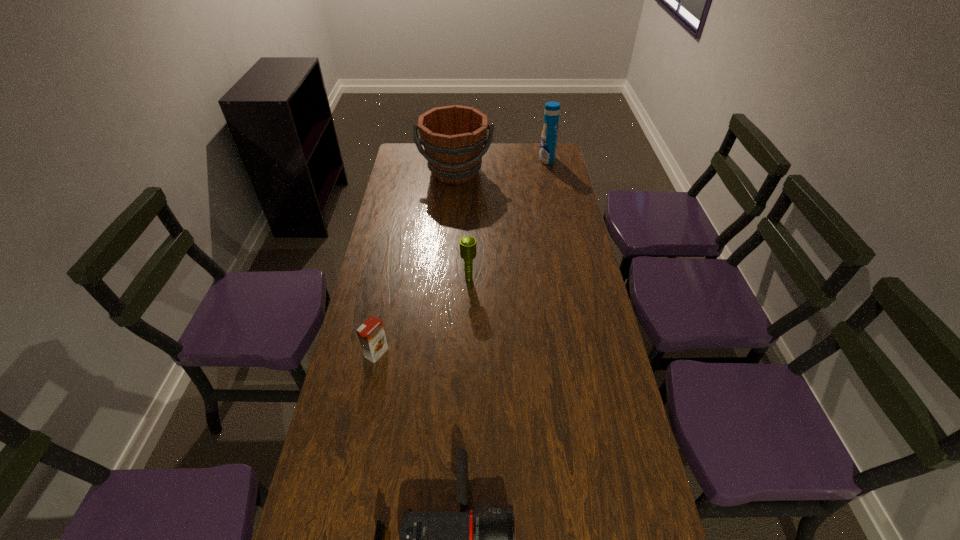
Image resolution: width=960 pixels, height=540 pixels. I want to click on free location located 0.120m on the back of the fourth farthest object, so click(385, 313).

Where is `detergent positioned at the far edge`? The width and height of the screenshot is (960, 540). detergent positioned at the far edge is located at coordinates (548, 143).

This screenshot has height=540, width=960. What are the coordinates of `bucket at the far edge` in the screenshot? It's located at (453, 137).

Locate an element on the screen. This screenshot has height=540, width=960. bucket present at the left edge is located at coordinates (453, 137).

Locate an element on the screen. This screenshot has height=540, width=960. orange juice positioned at the left edge is located at coordinates (371, 334).

Where is `object present at the right edge`? object present at the right edge is located at coordinates (548, 143).

Image resolution: width=960 pixels, height=540 pixels. I want to click on object positioned at the far left corner, so 453,137.

Find the location of a particular element. object located in the far right corner section of the desktop is located at coordinates (548, 143).

Identify the location of vacant space at the far edge of the desktop. (500, 164).

The width and height of the screenshot is (960, 540). Find the location of `vacant space at the left edge`. vacant space at the left edge is located at coordinates (395, 172).